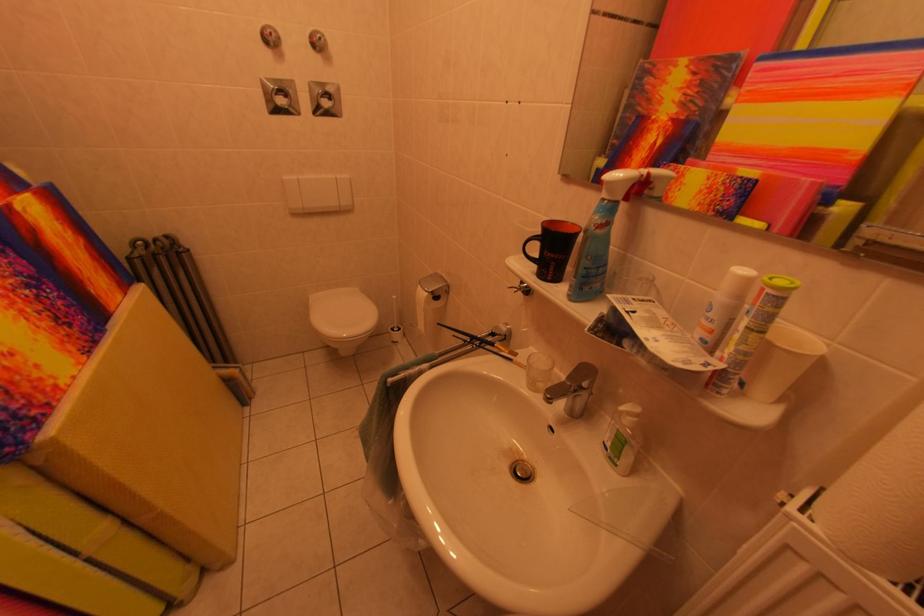
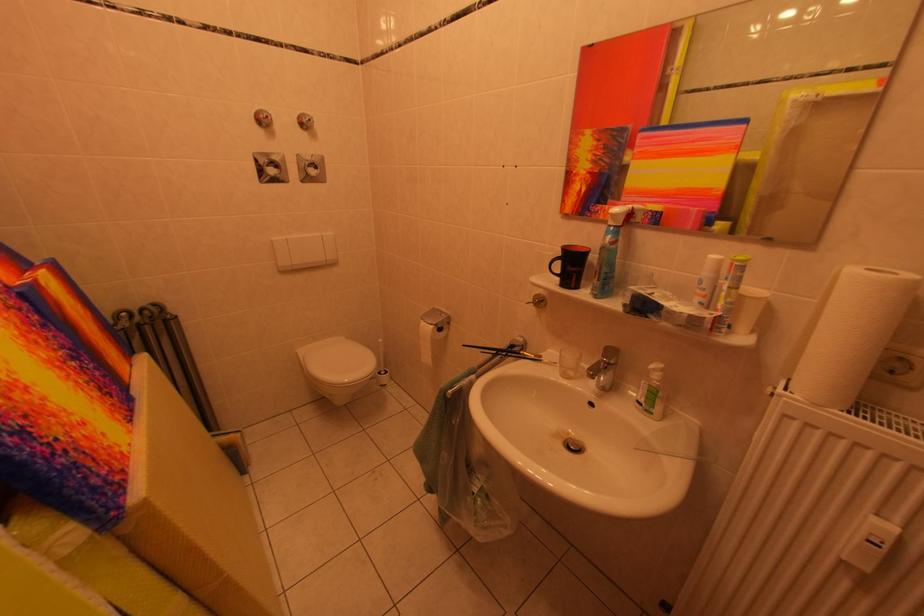
Locate, in the second image, the point that corresponds to (x=756, y=359) in the first image.

(739, 307)